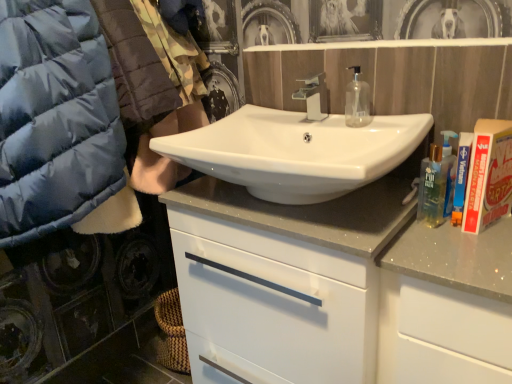
Question: In terms of height, does silver metallic faucet at center look taller or shorter compared to transparent plastic mouthwash at center?

Choices:
 (A) short
 (B) tall

Answer: (A)

Question: From a real-world perspective, is silver metallic faucet at center positioned above or below transparent plastic mouthwash at center?

Choices:
 (A) above
 (B) below

Answer: (B)

Question: Estimate the real-world distances between objects in this image. Which object is farther from the blue plastic bottle at right?

Choices:
 (A) transparent plastic mouthwash at center
 (B) white glossy cabinet at center
 (C) white glossy sink at center
 (D) silver metallic faucet at center
 (E) matte blue puffer jacket at left

Answer: (E)

Question: Estimate the real-world distances between objects in this image. Which object is farther from the transparent plastic mouthwash at center?

Choices:
 (A) silver metallic faucet at center
 (B) white glossy cabinet at center
 (C) white glossy sink at center
 (D) matte blue puffer jacket at left
 (E) blue plastic bottle at right

Answer: (D)